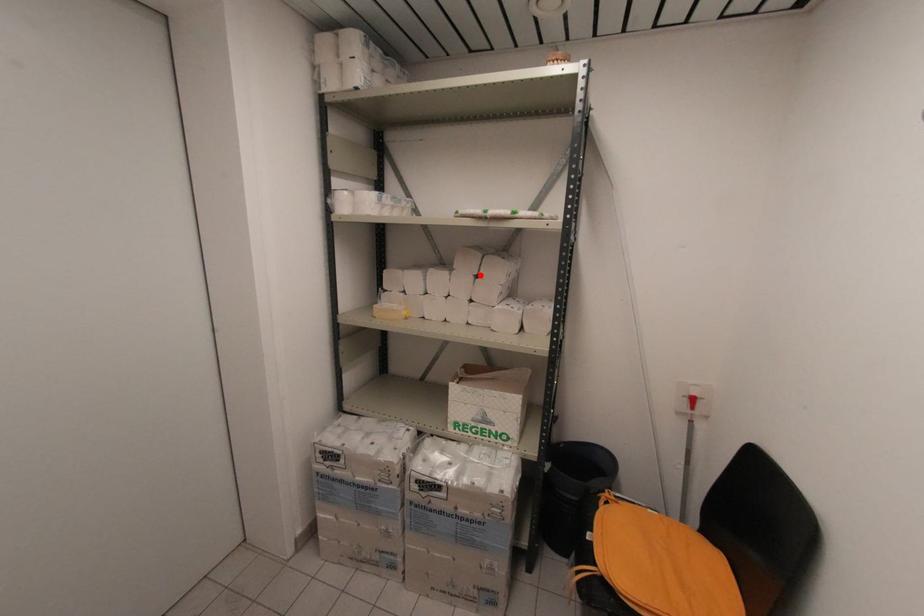
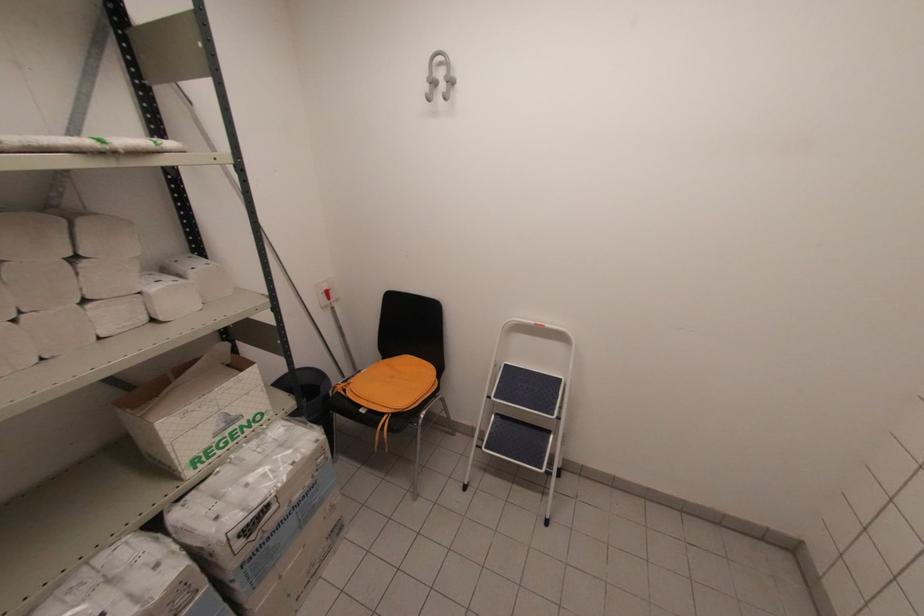
The point at the highlighted location is marked in the first image. Where is the corresponding point in the second image?

(81, 254)